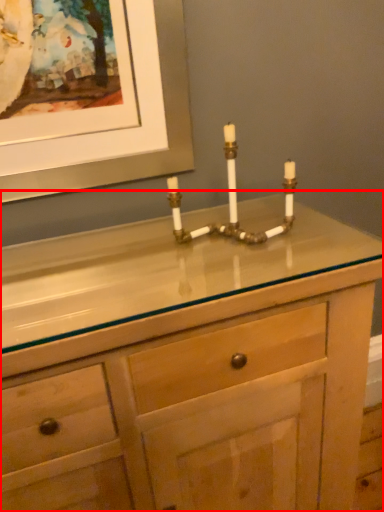
Question: From the image, what is the correct spatial relationship of chest of drawers (annotated by the red box) in relation to candle holder?

Choices:
 (A) right
 (B) left

Answer: (B)